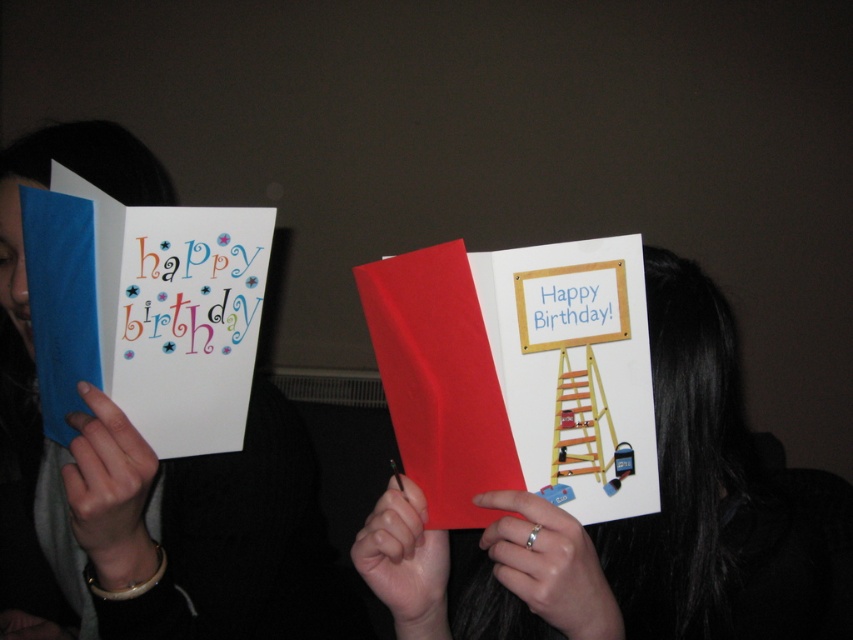
Question: Estimate the real-world distances between objects in this image. Which object is farther from the matte white greeting card at center?

Choices:
 (A) wooden ladder at center
 (B) white paper card at center

Answer: (B)

Question: Among these points, which one is farthest from the camera?

Choices:
 (A) (61, 282)
 (B) (527, 276)

Answer: (A)

Question: Can you confirm if matte white greeting card at center is positioned to the left of wooden ladder at center?

Choices:
 (A) yes
 (B) no

Answer: (A)

Question: Which of the following is the farthest from the observer?

Choices:
 (A) (123, 380)
 (B) (566, 454)
 (C) (418, 250)

Answer: (C)

Question: Where is matte white greeting card at left located in relation to wooden ladder at center in the image?

Choices:
 (A) right
 (B) left

Answer: (B)

Question: Does matte white greeting card at center have a lesser width compared to wooden ladder at center?

Choices:
 (A) no
 (B) yes

Answer: (A)